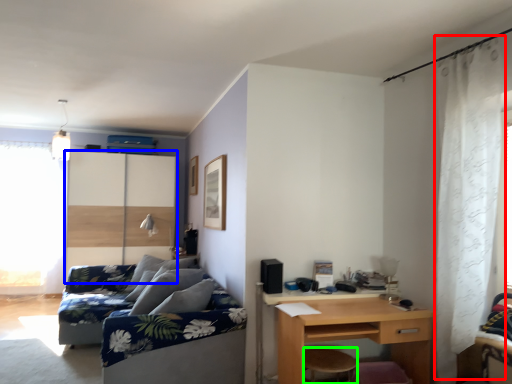
Question: Considering the real-world distances, which object is closest to curtain (highlighted by a red box)? screen door (highlighted by a blue box) or stool (highlighted by a green box).

Choices:
 (A) screen door
 (B) stool

Answer: (B)